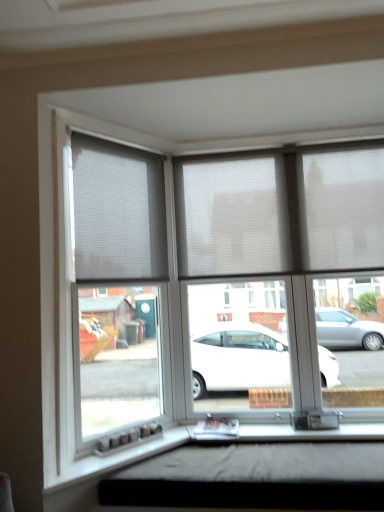
Question: Considering the positions of white pleated blinds at center and black matte window box at lower center in the image, is white pleated blinds at center wider or thinner than black matte window box at lower center?

Choices:
 (A) thin
 (B) wide

Answer: (A)

Question: From the image's perspective, is white pleated blinds at center above or below black matte window box at lower center?

Choices:
 (A) above
 (B) below

Answer: (A)

Question: Considering the real-world distances, which object is farthest from the white pleated blinds at center?

Choices:
 (A) black matte window box at lower center
 (B) white pleated blind at upper left

Answer: (A)

Question: Considering the real-world distances, which object is closest to the white pleated blinds at center?

Choices:
 (A) black matte window box at lower center
 (B) white pleated blind at upper left

Answer: (B)